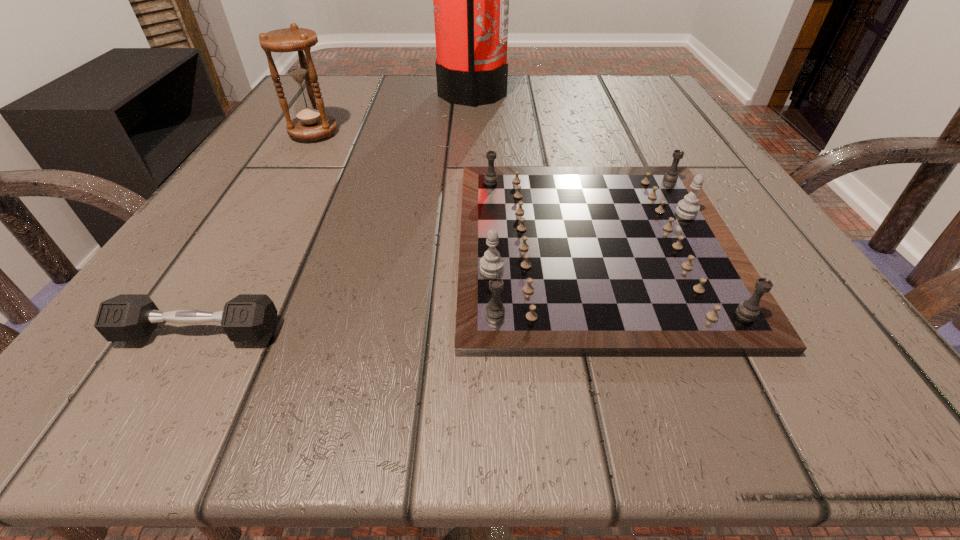
This screenshot has width=960, height=540. Identify the location of vacant region between the shortest object and the second farthest object. (256, 232).

Where is `free space between the farthest object and the dumbbell`? The height and width of the screenshot is (540, 960). free space between the farthest object and the dumbbell is located at coordinates (335, 213).

Locate an element on the screen. vacant space in between the shortest object and the chessboard is located at coordinates (396, 289).

Identify the location of vacant space that is in between the dumbbell and the fire extinguisher. This screenshot has width=960, height=540. (335, 213).

Find the location of a particular element. object that can be found as the second closest to the dumbbell is located at coordinates (294, 44).

Choose which object is the nearest neighbor to the farthest object. Please provide its 2D coordinates. Your answer should be formatted as a tuple, i.e. [(x, y)], where the tuple contains the x and y coordinates of a point satisfying the conditions above.

[(294, 44)]

Locate an element on the screen. This screenshot has height=540, width=960. free point that satisfies the following two spatial constraints: 1. on the board of the chessboard; 2. on the front side of the shortest object is located at coordinates (620, 332).

The width and height of the screenshot is (960, 540). In order to click on vacant region that satisfies the following two spatial constraints: 1. on the front side of the tallest object; 2. on the front side of the hourglass in this screenshot , I will do `click(471, 133)`.

The width and height of the screenshot is (960, 540). I want to click on vacant position in the image that satisfies the following two spatial constraints: 1. on the board of the third tallest object; 2. on the front side of the dumbbell, so click(x=620, y=332).

This screenshot has width=960, height=540. What are the coordinates of `vacant region that satisfies the following two spatial constraints: 1. on the board of the chessboard; 2. on the front side of the dumbbell` in the screenshot? It's located at (620, 332).